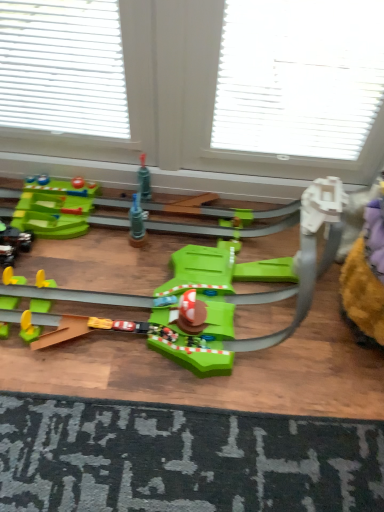
Question: Does green plastic toy at center, the 2th toy in the back-to-front sequence, appear on the left side of shiny black car at left, the first toy in the bottom-to-top sequence?

Choices:
 (A) no
 (B) yes

Answer: (A)

Question: Would you say green plastic toy at center, placed as the second toy when sorted from bottom to top, is outside shiny black car at left, arranged as the 2th toy when viewed from the top?

Choices:
 (A) no
 (B) yes

Answer: (B)

Question: From the image's perspective, is green plastic toy at center, positioned as the 1th toy in top-to-bottom order, beneath shiny black car at left, arranged as the 2th toy when viewed from the top?

Choices:
 (A) yes
 (B) no

Answer: (B)

Question: Would you say green plastic toy at center, positioned as the 1th toy in top-to-bottom order, contains shiny black car at left, the first toy in the bottom-to-top sequence?

Choices:
 (A) yes
 (B) no

Answer: (A)

Question: Is green plastic toy at center, the 2th toy in the back-to-front sequence, not close to shiny black car at left, which is counted as the second toy, starting from the front?

Choices:
 (A) no
 (B) yes

Answer: (A)

Question: In the image, is dark gray textured doormat at bottom positioned in front of or behind shiny black car at left, which is counted as the second toy, starting from the front?

Choices:
 (A) behind
 (B) front

Answer: (B)

Question: Do you think dark gray textured doormat at bottom is within shiny black car at left, the first toy in the bottom-to-top sequence, or outside of it?

Choices:
 (A) inside
 (B) outside

Answer: (B)

Question: From the image's perspective, relative to shiny black car at left, the second toy from the right, is dark gray textured doormat at bottom above or below?

Choices:
 (A) above
 (B) below

Answer: (B)

Question: Is dark gray textured doormat at bottom to the left or to the right of shiny black car at left, the first toy positioned from the back, in the image?

Choices:
 (A) left
 (B) right

Answer: (B)

Question: In the image, is dark gray textured doormat at bottom positioned in front of or behind green plastic toy at center, the 2th toy in the back-to-front sequence?

Choices:
 (A) behind
 (B) front

Answer: (A)

Question: Which is correct: dark gray textured doormat at bottom is inside green plastic toy at center, positioned as the 1th toy in top-to-bottom order, or outside of it?

Choices:
 (A) inside
 (B) outside

Answer: (B)

Question: Based on their sizes in the image, would you say dark gray textured doormat at bottom is bigger or smaller than green plastic toy at center, the 2th toy in the back-to-front sequence?

Choices:
 (A) small
 (B) big

Answer: (A)

Question: Looking at their shapes, would you say dark gray textured doormat at bottom is wider or thinner than green plastic toy at center, placed as the second toy when sorted from bottom to top?

Choices:
 (A) thin
 (B) wide

Answer: (B)

Question: From a real-world perspective, is green plastic toy at center, positioned as the 1th toy in top-to-bottom order, physically located above or below dark gray textured doormat at bottom?

Choices:
 (A) above
 (B) below

Answer: (A)

Question: Is green plastic toy at center, positioned as the 1th toy in top-to-bottom order, bigger or smaller than dark gray textured doormat at bottom?

Choices:
 (A) small
 (B) big

Answer: (B)